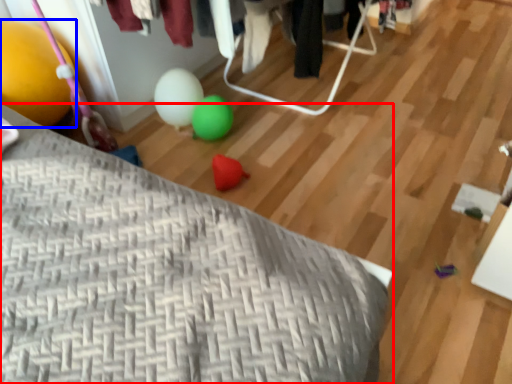
Question: Which object is closer to the camera taking this photo, furniture (highlighted by a red box) or balloon (highlighted by a blue box)?

Choices:
 (A) furniture
 (B) balloon

Answer: (A)